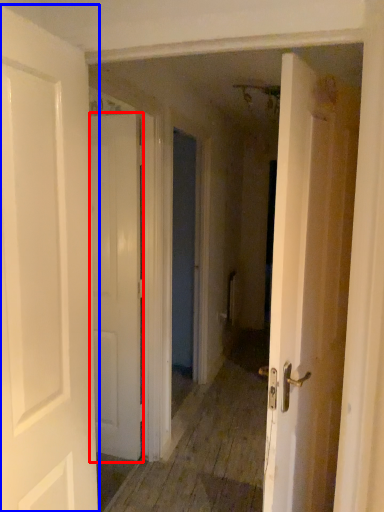
Question: Which object is further to the camera taking this photo, door (highlighted by a red box) or door (highlighted by a blue box)?

Choices:
 (A) door
 (B) door

Answer: (A)